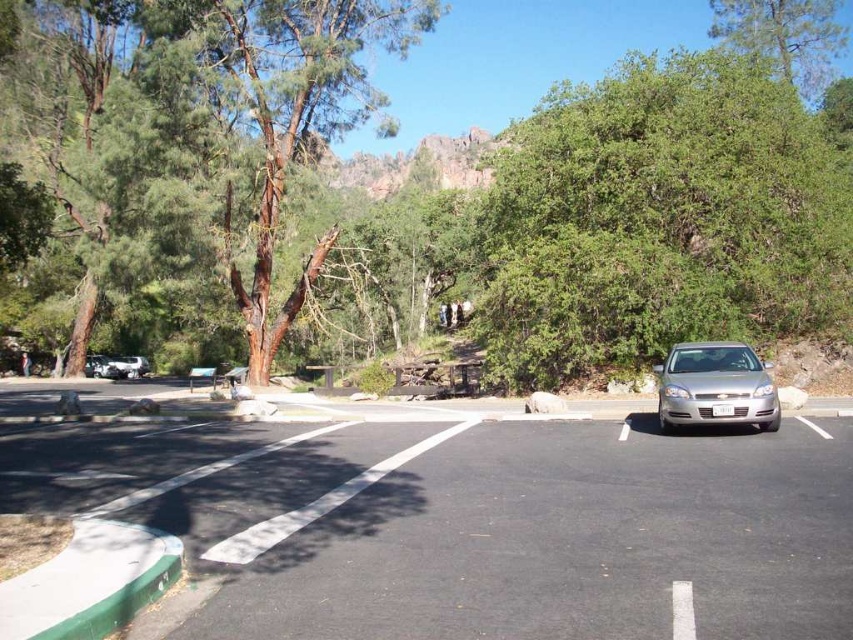
Can you confirm if black asphalt parking lot at center is positioned to the left of green leafy tree at center?

Indeed, black asphalt parking lot at center is positioned on the left side of green leafy tree at center.

Is point (360, 422) farther from viewer compared to point (718, 291)?

No, it is in front of (718, 291).

The height and width of the screenshot is (640, 853). Identify the location of black asphalt parking lot at center. (473, 522).

Does green leafy tree at center appear under green leafy tree at upper right?

Indeed, green leafy tree at center is positioned under green leafy tree at upper right.

From the picture: Who is higher up, green leafy tree at center or green leafy tree at upper right?

green leafy tree at upper right

Locate an element on the screen. The image size is (853, 640). green leafy tree at center is located at coordinates (660, 220).

Does point (692, 348) come farther from viewer compared to point (733, 20)?

That is False.

Which is behind, point (767, 404) or point (815, 61)?

Point (815, 61)

Locate an element on the screen. The width and height of the screenshot is (853, 640). satin silver sedan at right is located at coordinates click(x=715, y=387).

Locate an element on the screen. satin silver sedan at right is located at coordinates (715, 387).